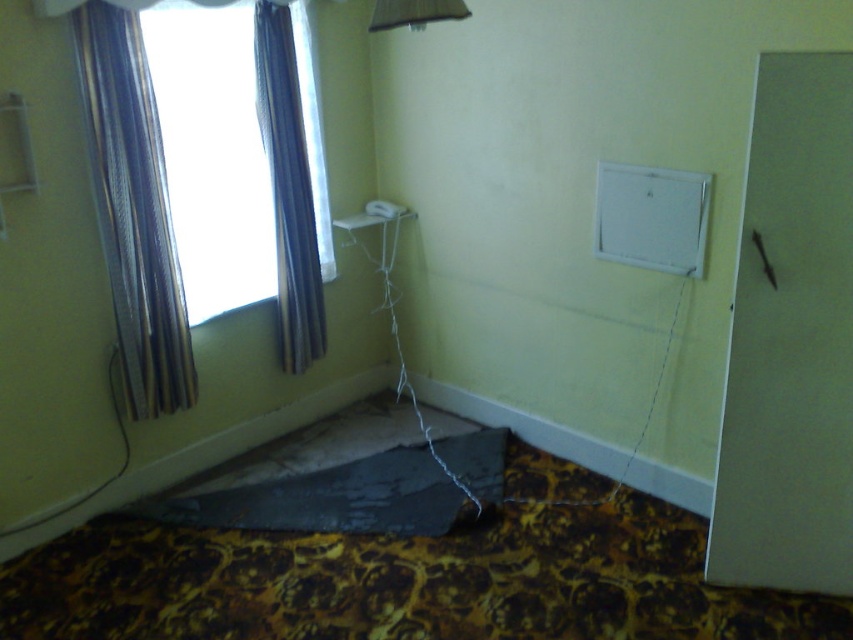
You are standing in the room and want to see outside through the transparent glass window at upper left. Can you see the satin fabric curtain at upper left blocking your view?

The transparent glass window at upper left is in front of the satin fabric curtain at upper left, so the curtain is behind the window and does not block your view.

You need to hang a picture frame that is 30 centimeters wide between the transparent glass window at upper left and the metallic fabric curtain at left. Can it fit without overlapping either object?

The distance between the transparent glass window at upper left and the metallic fabric curtain at left is 27.52 centimeters. Since the picture frame is 30 centimeters wide, it cannot fit without overlapping one of the objects.

You are standing in the room and want to place a new plant pot on the floor. The plant pot has a diameter of 30 cm. Considering the metallic fabric curtain at left, where should you avoid placing the plant pot to ensure it doesn

The metallic fabric curtain at left is located at point (x=134, y=211), so you should avoid placing the plant pot near that coordinate to prevent blocking the curtain or interfering with its operation.